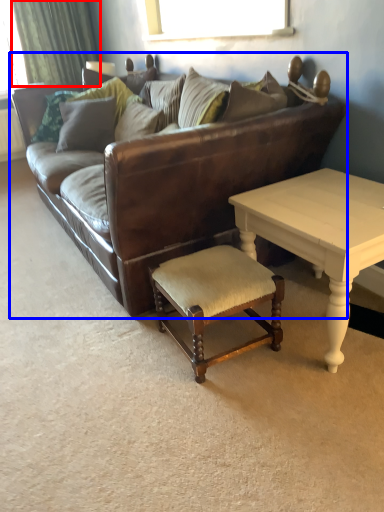
Question: Which of the following is the farthest to the observer, curtain (highlighted by a red box) or studio couch (highlighted by a blue box)?

Choices:
 (A) curtain
 (B) studio couch

Answer: (A)